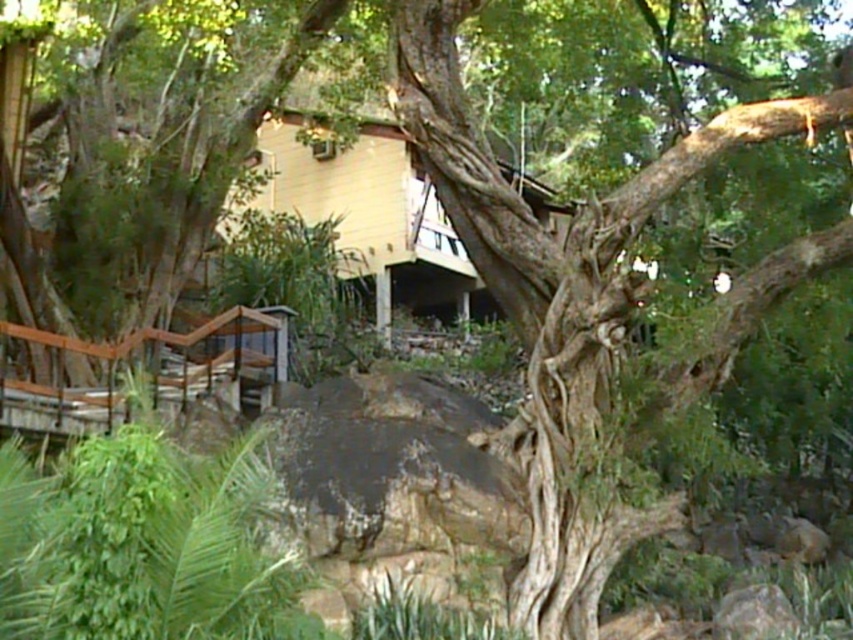
Question: In this image, where is gray rough stone at lower right located relative to brown rough stone at lower right?

Choices:
 (A) left
 (B) right

Answer: (A)

Question: Can you confirm if gray rough stone at lower right is smaller than brown rough stone at lower right?

Choices:
 (A) yes
 (B) no

Answer: (A)

Question: Which of the following is the farthest from the observer?

Choices:
 (A) (775, 541)
 (B) (787, 620)

Answer: (A)

Question: Does gray rough stone at lower right appear over brown rough stone at lower right?

Choices:
 (A) yes
 (B) no

Answer: (B)